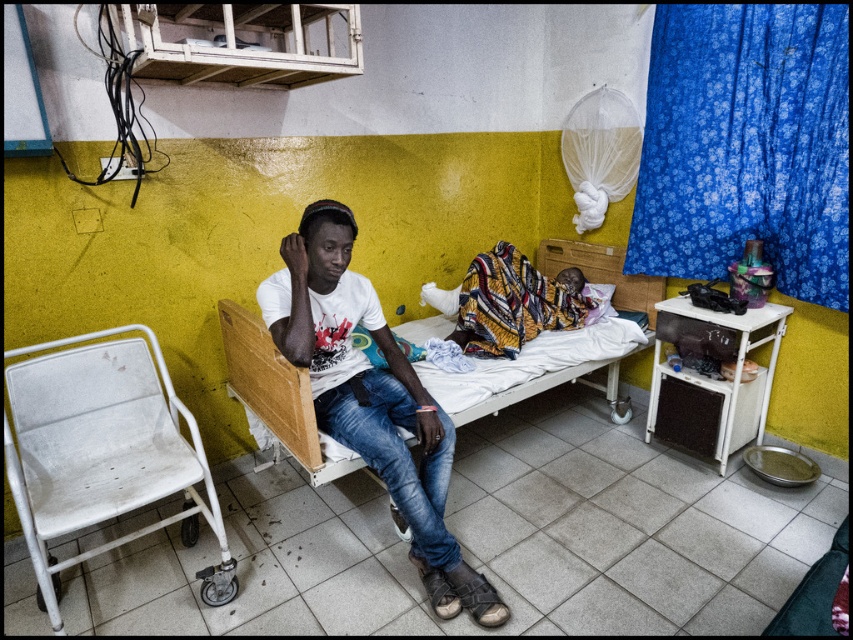
Based on the photo, you are a nurse in a hospital room. You need to place a medical chart on the white metal chair at lower left. Where exactly should you place it?

You should place the medical chart at point (103, 452) where the white metal chair at lower left is located.